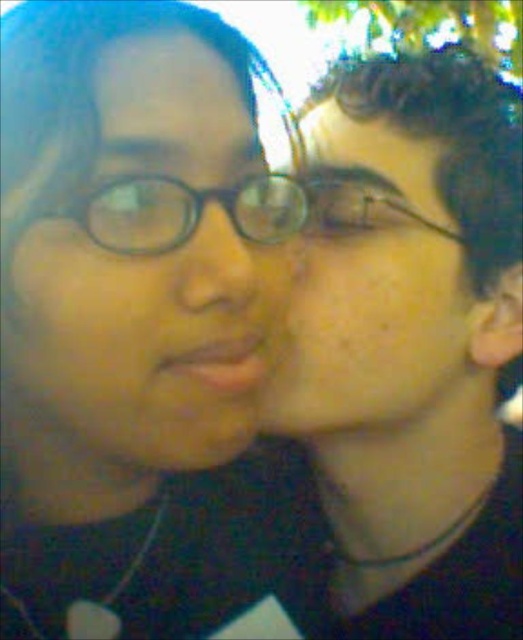
Between smooth skin face at right and smooth skin face at center, which one has less height?

With less height is smooth skin face at center.

Which is behind, point (319, 369) or point (368, 228)?

The point (368, 228) is behind.

Where is `smooth skin face at right`? This screenshot has height=640, width=523. smooth skin face at right is located at coordinates (415, 346).

Which of these two, smooth skin face at center or matte glass nose at center, stands taller?

With more height is smooth skin face at center.

Who is higher up, smooth skin face at center or matte glass nose at center?

smooth skin face at center is higher up.

Which is in front, point (346, 275) or point (210, 204)?

Positioned in front is point (210, 204).

Locate an element on the screen. The width and height of the screenshot is (523, 640). smooth skin face at center is located at coordinates (369, 284).

Between smooth skin face at center and black plastic glasses at center, which one is positioned lower?

smooth skin face at center is below.

Is point (418, 227) closer to camera compared to point (179, 243)?

That is False.

Where is `smooth skin face at center`? This screenshot has width=523, height=640. smooth skin face at center is located at coordinates (369, 284).